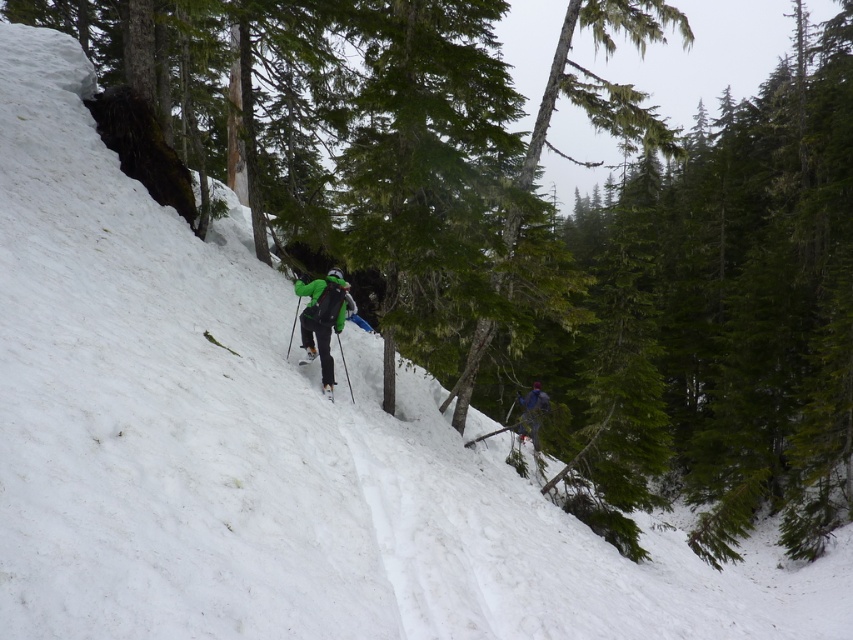
Question: Which point is farther to the camera?

Choices:
 (A) (299, 296)
 (B) (520, 400)
 (C) (314, 353)

Answer: (B)

Question: Does green matte jacket at center have a greater width compared to green matte ski at center?

Choices:
 (A) no
 (B) yes

Answer: (B)

Question: Estimate the real-world distances between objects in this image. Which object is closer to the green matte jacket at center?

Choices:
 (A) blue fabric jacket at center
 (B) green matte ski at center

Answer: (B)

Question: Is green matte jacket at center thinner than green matte ski at center?

Choices:
 (A) yes
 (B) no

Answer: (B)

Question: Considering the relative positions of blue fabric jacket at center and green matte ski at center in the image provided, where is blue fabric jacket at center located with respect to green matte ski at center?

Choices:
 (A) right
 (B) left

Answer: (A)

Question: Which is nearer to the green matte ski at center?

Choices:
 (A) green matte jacket at center
 (B) blue fabric jacket at center

Answer: (A)